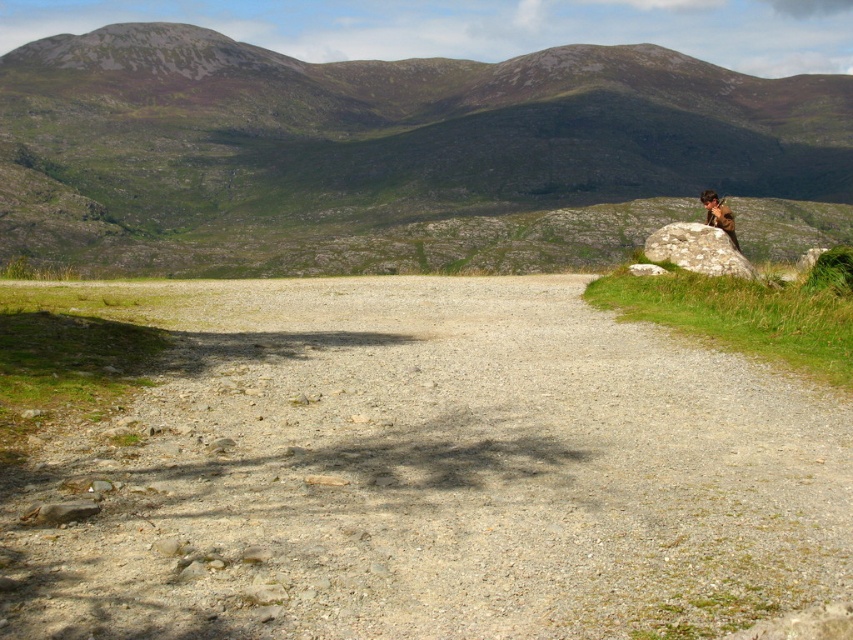
You are a hiker planning to walk along the gray gravel dirt track at center. You want to reach the green grassy mountain at upper center. Based on the scene, which direction should you walk to move towards the mountain?

The gray gravel dirt track at center is in front of green grassy mountain at upper center, so walking along the gray gravel dirt track at center towards its direction will lead you towards the green grassy mountain at upper center.

You are standing on the gravelly path and see the green grassy mountain at upper center and the brown fuzzy jacket at upper right. Which object is closer to you?

The brown fuzzy jacket at upper right is closer to you because it is positioned closer to the viewer than the green grassy mountain at upper center.

You are a hiker who wants to take a photo of the gray gravel dirt track at center and the brown fuzzy jacket at upper right. Which object should you focus on first to ensure both are in the frame?

You should focus on the gray gravel dirt track at center first because it is in front of the brown fuzzy jacket at upper right, so adjusting the camera to include the foreground object will naturally include the background one as well.